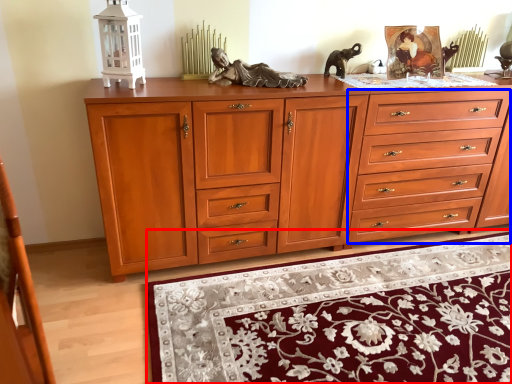
Question: Among these objects, which one is nearest to the camera, mat (highlighted by a red box) or drawer (highlighted by a blue box)?

Choices:
 (A) mat
 (B) drawer

Answer: (A)